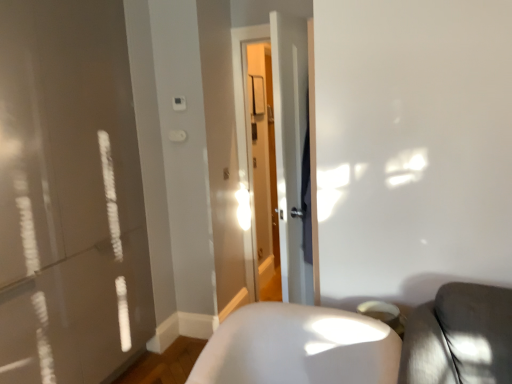
The height and width of the screenshot is (384, 512). What do you see at coordinates (298, 347) in the screenshot? I see `white glossy chair at lower right` at bounding box center [298, 347].

Locate an element on the screen. Image resolution: width=512 pixels, height=384 pixels. white glossy chair at lower right is located at coordinates (298, 347).

What are the coordinates of `transparent glass door at center` in the screenshot? It's located at (283, 133).

The image size is (512, 384). What do you see at coordinates (283, 133) in the screenshot?
I see `transparent glass door at center` at bounding box center [283, 133].

The width and height of the screenshot is (512, 384). In order to click on white glossy chair at lower right in this screenshot , I will do `click(298, 347)`.

Can you confirm if white glossy chair at lower right is positioned to the left of transparent glass door at center?

Correct, you'll find white glossy chair at lower right to the left of transparent glass door at center.

Which object is closer to the camera, white glossy chair at lower right or transparent glass door at center?

white glossy chair at lower right is closer to the camera.

Which is less distant, (252, 334) or (270, 28)?

Clearly, point (252, 334) is closer to the camera than point (270, 28).

From the image's perspective, would you say white glossy chair at lower right is shown under transparent glass door at center?

Correct, white glossy chair at lower right appears lower than transparent glass door at center in the image.

From a real-world perspective, which object stands above the other?

From a 3D spatial view, transparent glass door at center is above.

Can you confirm if white glossy chair at lower right is thinner than transparent glass door at center?

Incorrect, the width of white glossy chair at lower right is not less than that of transparent glass door at center.

Does white glossy chair at lower right have a greater height compared to transparent glass door at center?

No, white glossy chair at lower right is not taller than transparent glass door at center.

Who is bigger, white glossy chair at lower right or transparent glass door at center?

With larger size is white glossy chair at lower right.

Does white glossy chair at lower right contain transparent glass door at center?

No, transparent glass door at center is located outside of white glossy chair at lower right.

Is there a large distance between white glossy chair at lower right and transparent glass door at center?

No, there isn't a large distance between white glossy chair at lower right and transparent glass door at center.

Is white glossy chair at lower right looking in the opposite direction of transparent glass door at center?

white glossy chair at lower right is not turned away from transparent glass door at center.

How different are the orientations of white glossy chair at lower right and transparent glass door at center in degrees?

The facing directions of white glossy chair at lower right and transparent glass door at center are 109 degrees apart.

Measure the distance between white glossy chair at lower right and transparent glass door at center.

white glossy chair at lower right and transparent glass door at center are 22.02 inches apart from each other.

At what (x,y) coordinates should I click in order to perform the action: click on furniture that appears on the left of transparent glass door at center. Please return your answer as a coordinate pair (x, y). This screenshot has height=384, width=512. Looking at the image, I should click on [298, 347].

Based on the photo, based on their positions, is transparent glass door at center located to the left or right of white glossy chair at lower right?

From the image, it's evident that transparent glass door at center is to the right of white glossy chair at lower right.

Between transparent glass door at center and white glossy chair at lower right, which one is positioned behind?

transparent glass door at center is further from the camera.

Which is closer to the camera, (x=278, y=25) or (x=266, y=361)?

Point (x=278, y=25) is farther from the camera than point (x=266, y=361).

From the image's perspective, is transparent glass door at center on top of white glossy chair at lower right?

Indeed, from the image's perspective, transparent glass door at center is shown above white glossy chair at lower right.

From a real-world perspective, is transparent glass door at center over white glossy chair at lower right?

Yes, from a real-world perspective, transparent glass door at center is above white glossy chair at lower right.

Considering the sizes of objects transparent glass door at center and white glossy chair at lower right in the image provided, who is wider, transparent glass door at center or white glossy chair at lower right?

With larger width is white glossy chair at lower right.

Does transparent glass door at center have a lesser height compared to white glossy chair at lower right?

Incorrect, the height of transparent glass door at center does not fall short of that of white glossy chair at lower right.

Consider the image. Who is smaller, transparent glass door at center or white glossy chair at lower right?

transparent glass door at center.

Is transparent glass door at center not within white glossy chair at lower right?

Yes, transparent glass door at center is not within white glossy chair at lower right.

Can you see transparent glass door at center touching white glossy chair at lower right?

No, transparent glass door at center is not making contact with white glossy chair at lower right.

Is white glossy chair at lower right at the back of transparent glass door at center?

No.

Can you tell me how much transparent glass door at center and white glossy chair at lower right differ in facing direction?

The angle between the facing direction of transparent glass door at center and the facing direction of white glossy chair at lower right is 109 degrees.

The width and height of the screenshot is (512, 384). I want to click on screen door located above the white glossy chair at lower right (from a real-world perspective), so click(x=283, y=133).

Locate an element on the screen. This screenshot has height=384, width=512. screen door lying above the white glossy chair at lower right (from the image's perspective) is located at coordinates (283, 133).

This screenshot has height=384, width=512. Find the location of `furniture below the transparent glass door at center (from a real-world perspective)`. furniture below the transparent glass door at center (from a real-world perspective) is located at coordinates (298, 347).